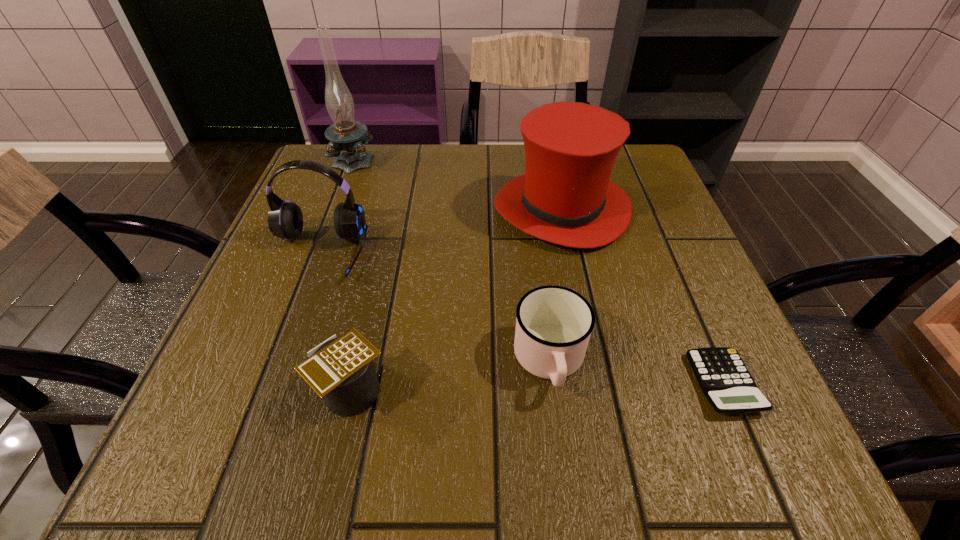
The width and height of the screenshot is (960, 540). I want to click on object that is positioned at the far right corner, so click(565, 197).

This screenshot has height=540, width=960. Identify the location of object at the near right corner. (724, 379).

Locate an element on the screen. free space at the far edge of the desktop is located at coordinates (516, 168).

Image resolution: width=960 pixels, height=540 pixels. What are the coordinates of `vacant space at the near edge` in the screenshot? It's located at (633, 433).

You are a GUI agent. You are given a task and a screenshot of the screen. Output one action in this format:
    pyautogui.click(x=<x>, y=<y>)
    Task: Click on the blank space at the left edge of the desktop
    This screenshot has width=960, height=540.
    Given the screenshot: What is the action you would take?
    pyautogui.click(x=304, y=229)

At what (x,y) coordinates should I click in order to perform the action: click on vacant space at the right edge of the desktop. Please return your answer as a coordinate pair (x, y). This screenshot has width=960, height=540. Looking at the image, I should click on (669, 206).

Image resolution: width=960 pixels, height=540 pixels. I want to click on vacant space at the far right corner, so click(629, 145).

Locate an element on the screen. Image resolution: width=960 pixels, height=540 pixels. free space between the headset and the mug is located at coordinates (434, 307).

Identify the location of free spot between the taller calculator and the tallest object. (352, 274).

The image size is (960, 540). Identify the location of vacant point located between the hat and the headset. (440, 231).